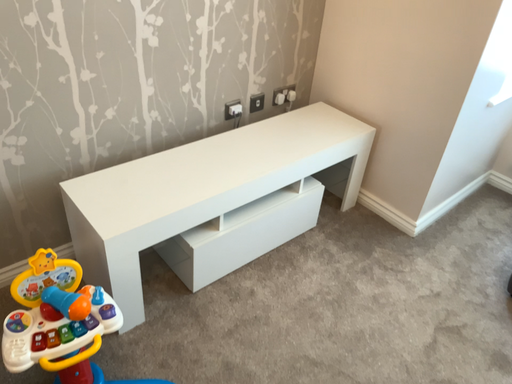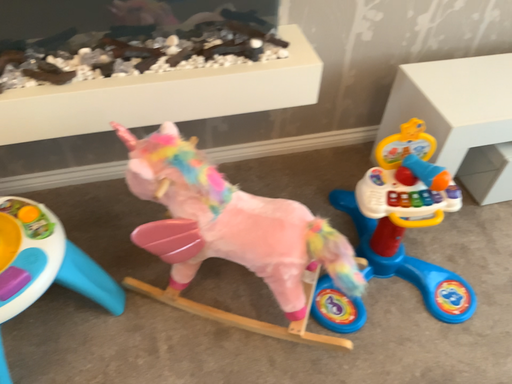
Question: Which way did the camera rotate in the video?

Choices:
 (A) rotated left
 (B) rotated right

Answer: (A)